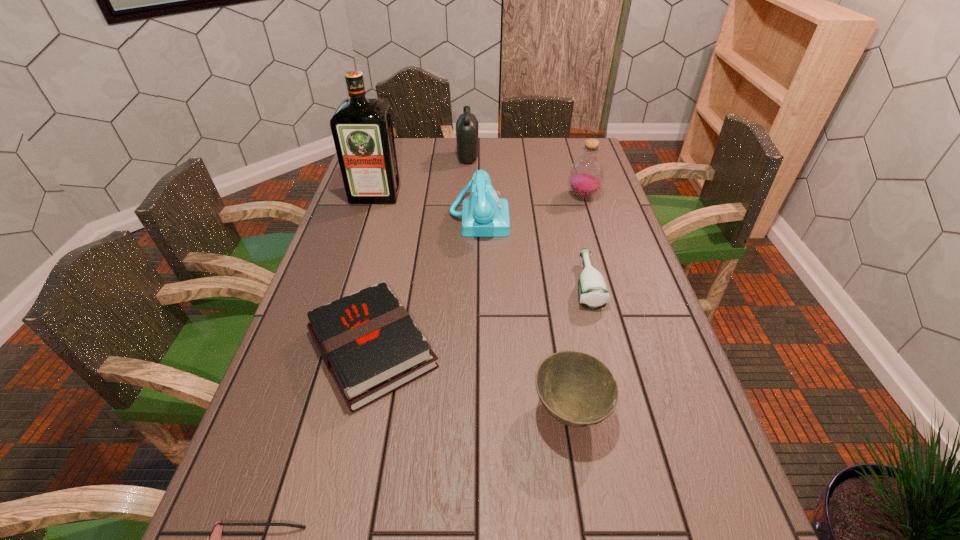
The height and width of the screenshot is (540, 960). In order to click on blank region between the shortest bottle and the tallest object in this screenshot , I will do `click(481, 240)`.

At what (x,y) coordinates should I click in order to perform the action: click on free space between the second farthest bottle and the farthest bottle. Please return your answer as a coordinate pair (x, y). Looking at the image, I should click on click(525, 177).

Image resolution: width=960 pixels, height=540 pixels. Find the location of `vacant region between the farthest object and the nearest bottle`. vacant region between the farthest object and the nearest bottle is located at coordinates (527, 221).

Identify the location of free space between the tallest object and the fifth shortest object. The image size is (960, 540). (427, 206).

Identify the location of vacant area that lies between the liquor and the telephone. The width and height of the screenshot is (960, 540). (427, 206).

The image size is (960, 540). I want to click on free space between the shortest bottle and the hardback book, so click(479, 317).

Locate an element on the screen. free space that is in between the fourth shortest object and the second farthest bottle is located at coordinates (576, 303).

The image size is (960, 540). Find the location of `object that is the fourth closest to the leftmost bottle`. object that is the fourth closest to the leftmost bottle is located at coordinates (593, 294).

Select which object appears as the sixth closest to the bowl. Please provide its 2D coordinates. Your answer should be formatted as a tuple, i.e. [(x, y)], where the tuple contains the x and y coordinates of a point satisfying the conditions above.

[(362, 129)]

Identify which bottle is the second nearest to the tallest object. Please provide its 2D coordinates. Your answer should be formatted as a tuple, i.e. [(x, y)], where the tuple contains the x and y coordinates of a point satisfying the conditions above.

[(586, 175)]